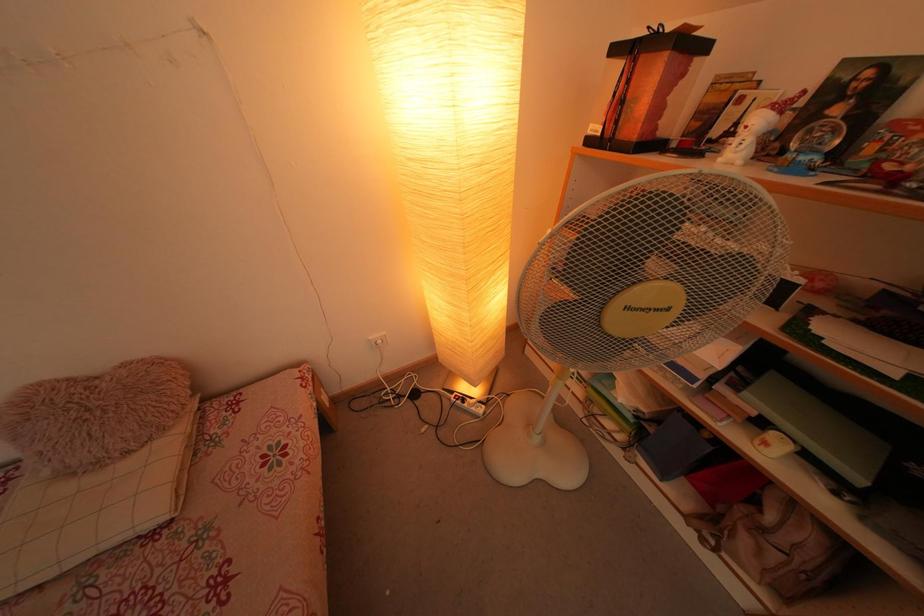
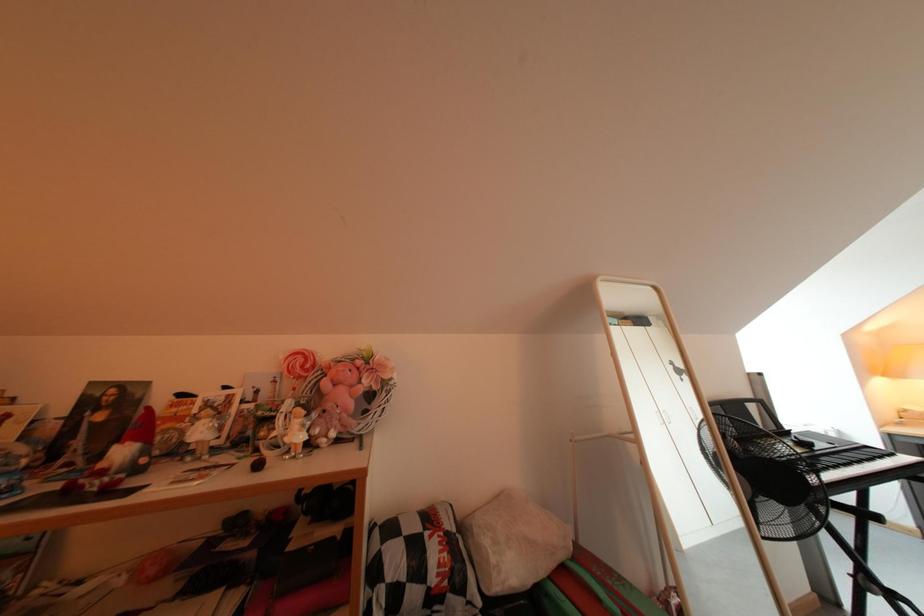
Question: The images are taken continuously from a first-person perspective. In which direction is your viewpoint rotating?

Choices:
 (A) Left
 (B) Right
 (C) Up
 (D) Down

Answer: (B)